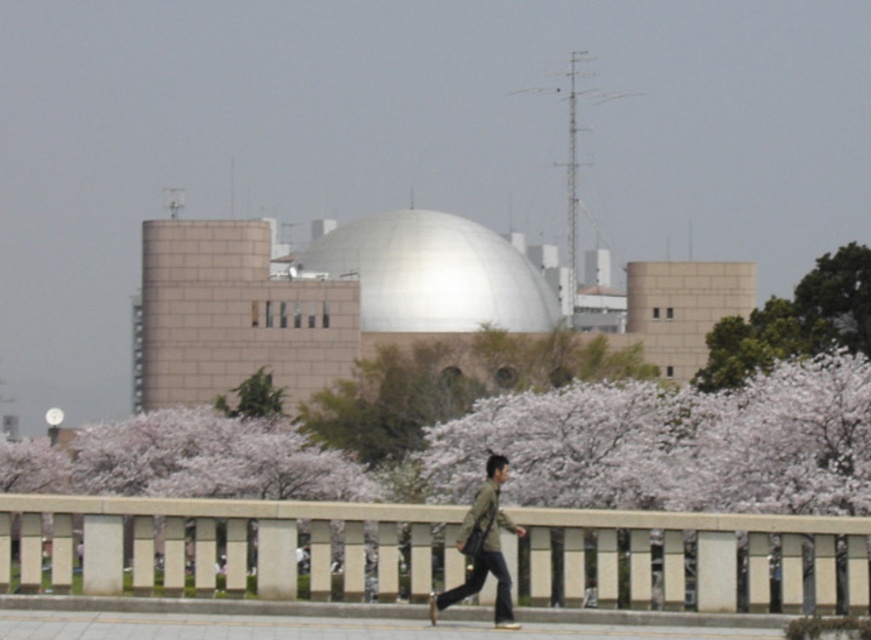
You are planning to install a new lighting system for the beige concrete rail at center and the white smooth dome at center. Based on their sizes, which object requires more lighting fixtures to cover its entire surface?

The white smooth dome at center requires more lighting fixtures because it has a larger size than the beige concrete rail at center.

You are standing at the entrance of the modern building and want to enter the dome. There is a beige concrete rail at center and a white smooth dome at center. Which object is shorter and should you avoid walking into?

The beige concrete rail at center is not as tall as the white smooth dome at center, so the beige concrete rail at center is shorter. You should avoid walking into the white smooth dome at center since it is taller.

You are standing at the point closer to the camera between the two points, point (x=525, y=292) and point (x=784, y=336). Which point are you standing at?

You are standing at point (x=525, y=292) because it is further to the camera than point (x=784, y=336).